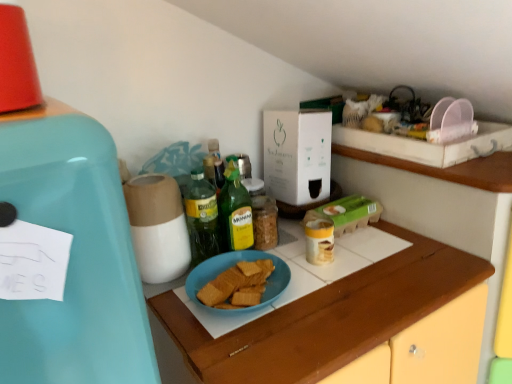
How much space does green glass bottle at center, which is counted as the 2th bottle, starting from the right, occupy horizontally?

green glass bottle at center, which is counted as the 2th bottle, starting from the right, is 3.96 inches wide.

Locate an element on the screen. This screenshot has height=384, width=512. teal matte refrigerator at left is located at coordinates (x=73, y=255).

In order to click on blue matte plate at center in this screenshot , I will do `click(237, 285)`.

From the picture: Which is correct: teal matte refrigerator at left is inside green glass bottle at center, which is counted as the 2th bottle, starting from the right, or outside of it?

teal matte refrigerator at left cannot be found inside green glass bottle at center, which is counted as the 2th bottle, starting from the right.

Between teal matte refrigerator at left and green glass bottle at center, which is counted as the first bottle, starting from the left, which one has less height?

With less height is teal matte refrigerator at left.

Is there a large distance between teal matte refrigerator at left and green glass bottle at center, which is counted as the first bottle, starting from the left?

They are positioned close to each other.

From the image's perspective, is teal matte refrigerator at left over green glass bottle at center, which is counted as the first bottle, starting from the left?

No, from the image's perspective, teal matte refrigerator at left is not over green glass bottle at center, which is counted as the first bottle, starting from the left.

Considering the sizes of green glass bottle at center, which is counted as the 2th bottle, starting from the right, and blue matte plate at center in the image, is green glass bottle at center, which is counted as the 2th bottle, starting from the right, bigger or smaller than blue matte plate at center?

Clearly, green glass bottle at center, which is counted as the 2th bottle, starting from the right, is larger in size than blue matte plate at center.

From the image's perspective, does green glass bottle at center, which is counted as the 2th bottle, starting from the right, appear higher than blue matte plate at center?

Correct, green glass bottle at center, which is counted as the 2th bottle, starting from the right, appears higher than blue matte plate at center in the image.

Is green glass bottle at center, which is counted as the 2th bottle, starting from the right, placed right next to blue matte plate at center?

No, green glass bottle at center, which is counted as the 2th bottle, starting from the right, is not in contact with blue matte plate at center.

How many degrees apart are the facing directions of green glass bottle at center, which is counted as the 2th bottle, starting from the right, and teal matte refrigerator at left?

green glass bottle at center, which is counted as the 2th bottle, starting from the right, and teal matte refrigerator at left are facing 1.97 degrees away from each other.

In the scene shown: From the image's perspective, which one is positioned lower, green glass bottle at center, which is counted as the first bottle, starting from the left, or teal matte refrigerator at left?

teal matte refrigerator at left, from the image's perspective.

From a real-world perspective, count 1st bottles downward from the teal matte refrigerator at left and point to it. Please provide its 2D coordinates.

[(201, 217)]

Can you confirm if green glass bottle at center, which is counted as the first bottle, starting from the left, is taller than teal matte refrigerator at left?

Correct, green glass bottle at center, which is counted as the first bottle, starting from the left, is much taller as teal matte refrigerator at left.

Which is nearer, (218, 281) or (42, 327)?

Point (218, 281).

Would you say blue matte plate at center contains teal matte refrigerator at left?

No, teal matte refrigerator at left is not inside blue matte plate at center.

From the image's perspective, is blue matte plate at center on teal matte refrigerator at left?

Actually, blue matte plate at center appears below teal matte refrigerator at left in the image.

From the image's perspective, which is below, green glass bottle at center, positioned as the second bottle in left-to-right order, or white cardboard box at center?

green glass bottle at center, positioned as the second bottle in left-to-right order.

Based on the photo, is green glass bottle at center, positioned as the second bottle in left-to-right order, looking in the opposite direction of white cardboard box at center?

That's not correct — green glass bottle at center, positioned as the second bottle in left-to-right order, is not looking away from white cardboard box at center.

Which bottle is the 1st one when counting from the left side of the white cardboard box at center? Please provide its 2D coordinates.

[(234, 212)]

Is green glass bottle at center, positioned as the second bottle in left-to-right order, bigger than white cardboard box at center?

Incorrect, green glass bottle at center, positioned as the second bottle in left-to-right order, is not larger than white cardboard box at center.

Considering the sizes of teal matte refrigerator at left and blue matte plate at center in the image, is teal matte refrigerator at left bigger or smaller than blue matte plate at center?

Clearly, teal matte refrigerator at left is larger in size than blue matte plate at center.

From a real-world perspective, which object stands above the other?

In real-world perspective, teal matte refrigerator at left is above.

Which is less distant, (51, 320) or (262, 292)?

Point (51, 320) is positioned closer to the camera compared to point (262, 292).

Does green glass bottle at center, which is the 1th bottle from right to left, turn towards blue matte plate at center?

No, green glass bottle at center, which is the 1th bottle from right to left, is not aimed at blue matte plate at center.

In order to click on cabinetry lying on the right of green glass bottle at center, positioned as the second bottle in left-to-right order in this screenshot , I will do `click(314, 312)`.

Based on the photo, can you confirm if green glass bottle at center, positioned as the second bottle in left-to-right order, is wider than blue matte plate at center?

Incorrect, the width of green glass bottle at center, positioned as the second bottle in left-to-right order, does not surpass that of blue matte plate at center.

Which is in front, point (225, 174) or point (335, 345)?

Point (335, 345)

Identify the location of home appliance in front of the green glass bottle at center, which is counted as the first bottle, starting from the left. (73, 255).

What are the coordinates of `food below the green glass bottle at center, which is counted as the 2th bottle, starting from the right (from a real-world perspective)` in the screenshot? It's located at (237, 285).

Consider the image. Which object lies further to the anchor point green glass bottle at center, which is counted as the first bottle, starting from the left, teal matte refrigerator at left or green glass bottle at center, which is the 1th bottle from right to left?

teal matte refrigerator at left is further to green glass bottle at center, which is counted as the first bottle, starting from the left.

Estimate the real-world distances between objects in this image. Which object is further from green glass bottle at center, which is the 1th bottle from right to left, blue matte plate at center or blue matte plate at center?

blue matte plate at center.

Consider the image. When comparing their distances from blue matte plate at center, does green glass bottle at center, positioned as the second bottle in left-to-right order, or blue matte plate at center seem further?

The object further to blue matte plate at center is blue matte plate at center.

Considering their positions, is green glass bottle at center, which is counted as the first bottle, starting from the left, positioned closer to green glass bottle at center, which is the 1th bottle from right to left, than teal matte refrigerator at left?

green glass bottle at center, which is counted as the first bottle, starting from the left, lies closer to green glass bottle at center, which is the 1th bottle from right to left, than the other object.

When comparing their distances from green glass bottle at center, which is counted as the first bottle, starting from the left, does green glass bottle at center, which is the 1th bottle from right to left, or teal matte refrigerator at left seem further?

teal matte refrigerator at left.

Which object lies further to the anchor point green glass bottle at center, which is counted as the 2th bottle, starting from the right, blue matte plate at center or blue matte plate at center?

The object further to green glass bottle at center, which is counted as the 2th bottle, starting from the right, is blue matte plate at center.

When comparing their distances from green glass bottle at center, positioned as the second bottle in left-to-right order, does white cardboard box at center or blue matte plate at center seem further?

blue matte plate at center is positioned further to the anchor green glass bottle at center, positioned as the second bottle in left-to-right order.

Estimate the real-world distances between objects in this image. Which object is further from blue matte plate at center, green glass bottle at center, which is counted as the 2th bottle, starting from the right, or white cardboard box at center?

Based on the image, white cardboard box at center appears to be further to blue matte plate at center.

You are a GUI agent. You are given a task and a screenshot of the screen. Output one action in this format:
    pyautogui.click(x=<x>, y=<y>)
    Task: Click on the food positioned between teal matte refrigerator at left and green glass bottle at center, positioned as the second bottle in left-to-right order, from near to far
    The height and width of the screenshot is (384, 512).
    Given the screenshot: What is the action you would take?
    pyautogui.click(x=237, y=285)

Locate an element on the screen. The height and width of the screenshot is (384, 512). cabinetry between teal matte refrigerator at left and green glass bottle at center, which is counted as the 2th bottle, starting from the right, along the z-axis is located at coordinates 314,312.

Find the location of a particular element. bottle between green glass bottle at center, positioned as the second bottle in left-to-right order, and blue matte plate at center vertically is located at coordinates (201, 217).

Identify the location of bottle located between teal matte refrigerator at left and green glass bottle at center, positioned as the second bottle in left-to-right order, in the depth direction. This screenshot has width=512, height=384. coord(201,217).